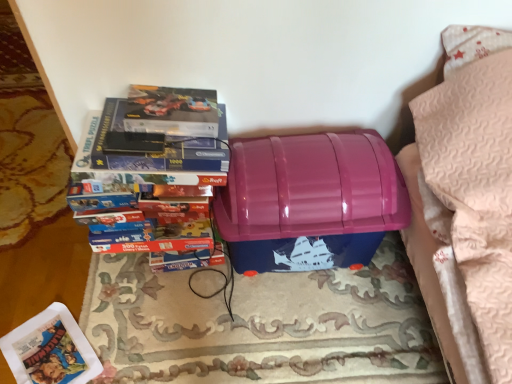
You are a GUI agent. You are given a task and a screenshot of the screen. Output one action in this format:
    pyautogui.click(x=<x>, y=<y>)
    Task: Click on the vacant region in front of blue cardboard puzzle at left
    This screenshot has height=384, width=512.
    Given the screenshot: What is the action you would take?
    pyautogui.click(x=153, y=320)